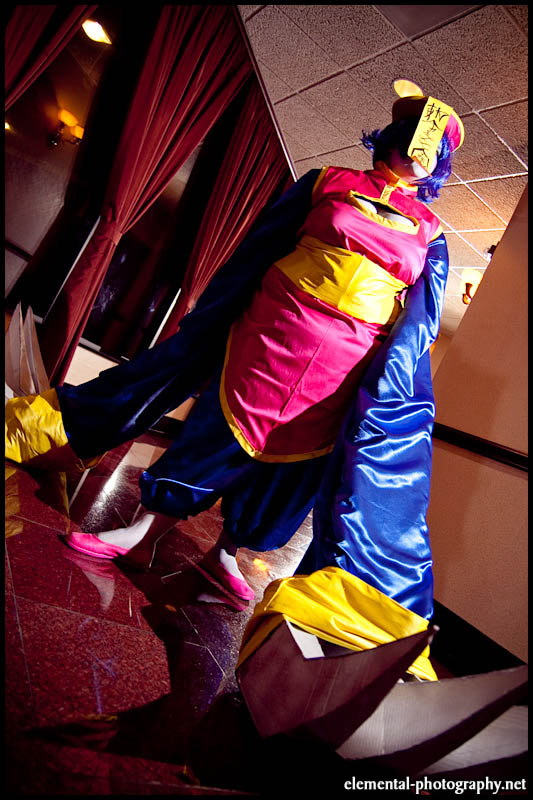
Where is `wall sconces`? This screenshot has height=800, width=533. wall sconces is located at coordinates (80, 130), (66, 120).